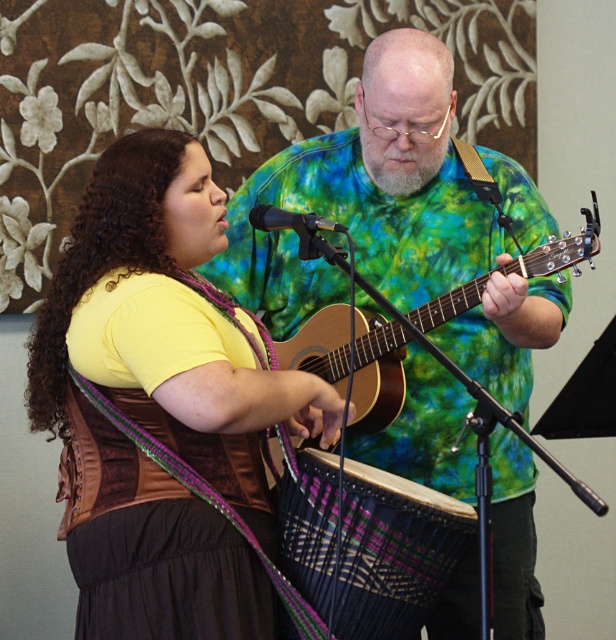
Question: Which point is farther to the camera?

Choices:
 (A) (330, 244)
 (B) (399, 33)
 (C) (386, 97)

Answer: (B)

Question: Which point is farther to the camera?

Choices:
 (A) grayish-green beard at center
 (B) green tie-dye shirt at center
 (C) black woven drum at center
 (D) acoustic wood guitar at center

Answer: (A)

Question: Can you confirm if green tie-dye shirt at center is positioned to the right of black woven drum at center?

Choices:
 (A) yes
 (B) no

Answer: (A)

Question: Which of the following is the farthest from the observer?

Choices:
 (A) acoustic wood guitar at center
 (B) green tie-dye shirt at center
 (C) black woven drum at center

Answer: (B)

Question: Can you confirm if green tie-dye shirt at center is positioned above acoustic wood guitar at center?

Choices:
 (A) yes
 (B) no

Answer: (B)

Question: Does black woven drum at center have a smaller size compared to grayish-green beard at center?

Choices:
 (A) yes
 (B) no

Answer: (B)